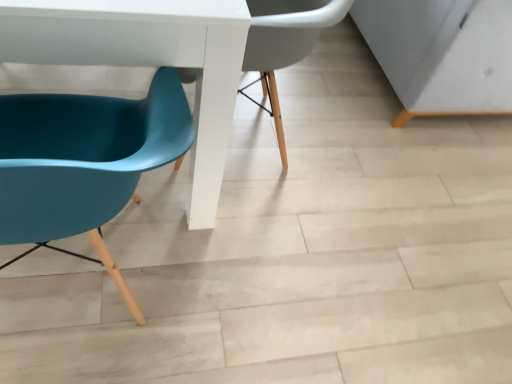
The image size is (512, 384). Identify the location of spots to the right of teal plastic chair at left, arranged as the 1th chair when ordered from the bottom. tap(252, 287).